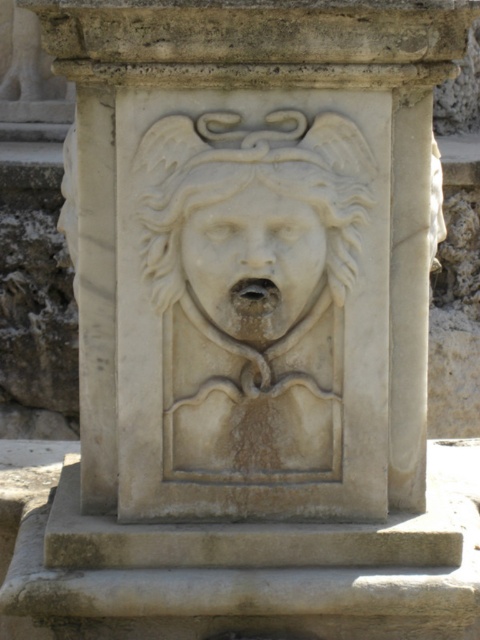
You are an archaeologist examining the fountain. You notice a point at coordinates (252, 237). What does this point indicate?

The point at (252, 237) indicates the white marble lion at center.

You are an art conservator assessing the fountain. You need to determine which object is wider to decide where to place protective covers. Which is wider, the white marble lion at center or the white marble face at center?

The white marble lion at center is wider than the white marble face at center according to the description.

You are an art conservator examining the marble fountain. You notice two central elements, the white marble lion at center and the white marble face at center. Which one has a greater vertical height?

The white marble lion at center is much taller than the white marble face at center.